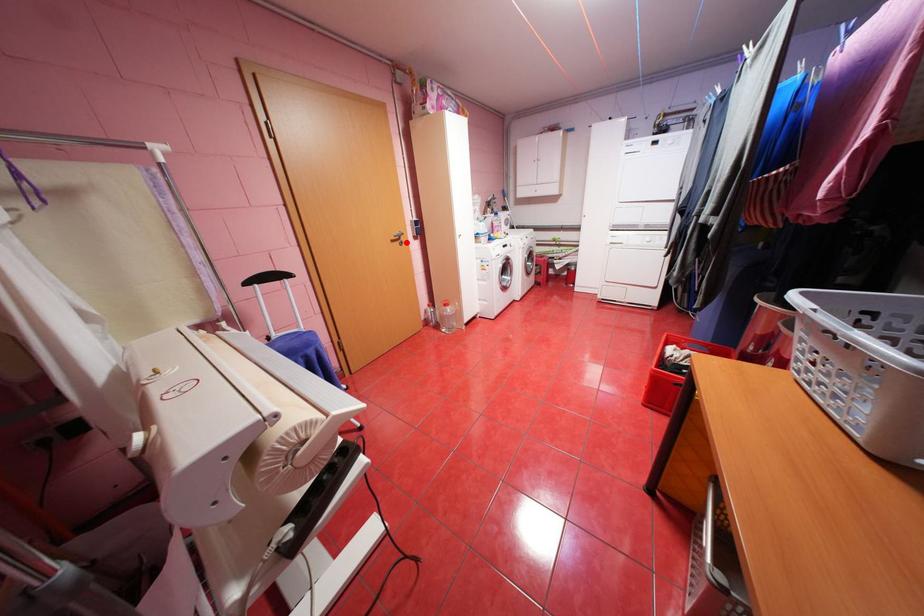
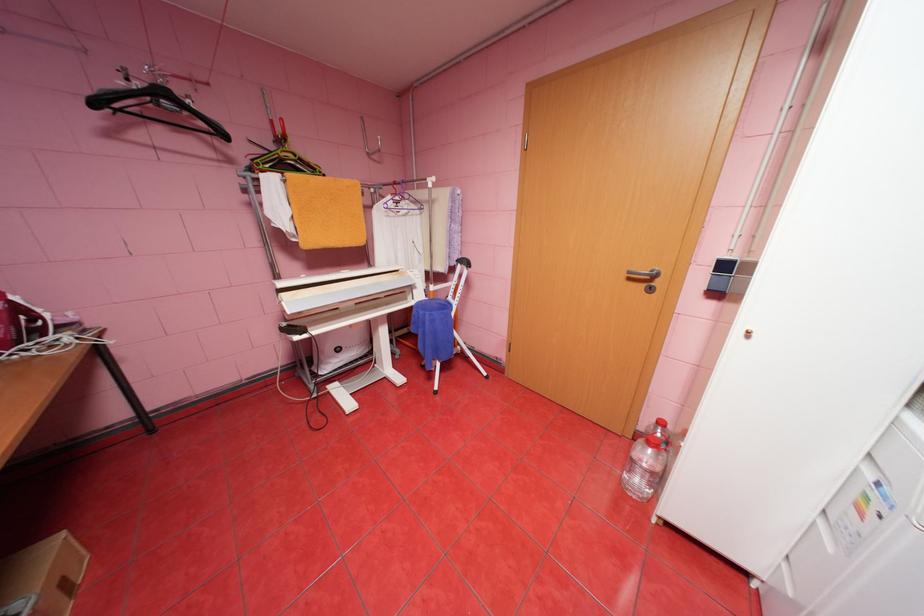
Find the pixel in the second image that matches the highlighted location in the first image.

(650, 285)